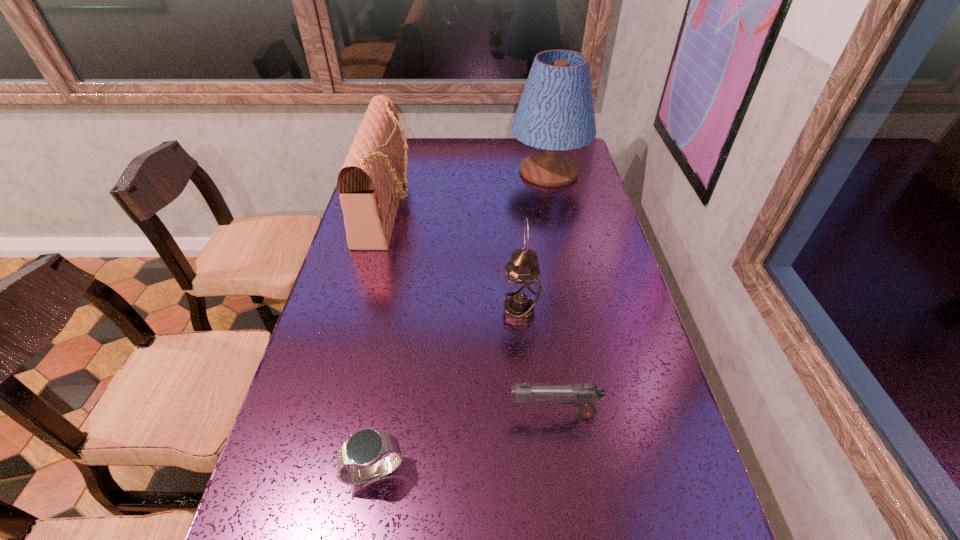
The height and width of the screenshot is (540, 960). Find the location of `free space located in the direction the fourth farthest object is aimed`. free space located in the direction the fourth farthest object is aimed is located at coordinates (487, 415).

This screenshot has width=960, height=540. In order to click on vacant position located on the right of the watch in this screenshot , I will do `click(445, 471)`.

Image resolution: width=960 pixels, height=540 pixels. I want to click on object at the far edge, so click(556, 112).

Where is `handbag at the left edge`? handbag at the left edge is located at coordinates (370, 183).

What are the coordinates of `watch that is at the left edge` in the screenshot? It's located at pos(363,450).

Locate an element on the screen. The height and width of the screenshot is (540, 960). object located at the right edge is located at coordinates (556, 112).

Locate an element on the screen. The image size is (960, 540). object that is at the far right corner is located at coordinates (556, 112).

Identify the location of vacant area at the far edge of the desktop. (496, 154).

Find the location of a particular element. free space at the left edge of the desktop is located at coordinates (273, 466).

Where is `vacant region at the right edge of the desktop`? This screenshot has height=540, width=960. vacant region at the right edge of the desktop is located at coordinates (598, 255).